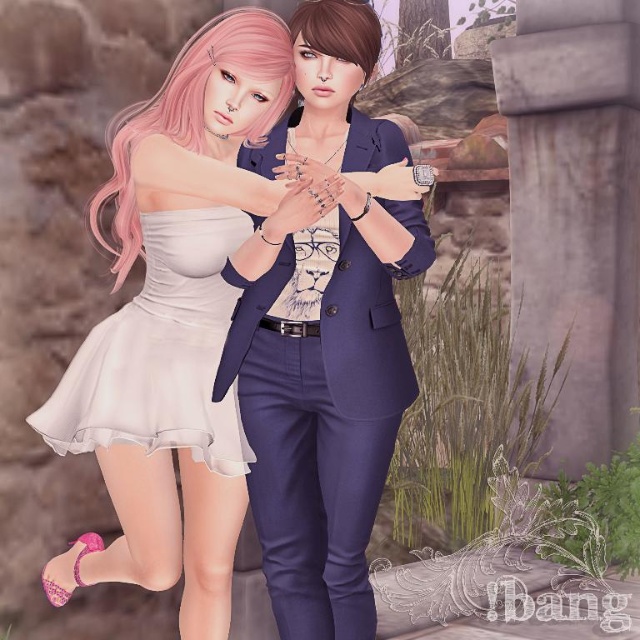
Looking at this image, does navy blue suit at center have a smaller size compared to white satin dress at center?

No.

Measure the distance between navy blue suit at center and camera.

A distance of 1.78 meters exists between navy blue suit at center and camera.

Locate an element on the screen. navy blue suit at center is located at coordinates (323, 422).

Can you confirm if matte white dress at center is positioned above white satin dress at center?

Correct, matte white dress at center is located above white satin dress at center.

Describe the element at coordinates (173, 324) in the screenshot. I see `matte white dress at center` at that location.

Is point (216, 272) positioned before point (67, 444)?

Yes, point (216, 272) is in front of point (67, 444).

The height and width of the screenshot is (640, 640). In order to click on matte white dress at center in this screenshot , I will do `click(173, 324)`.

Is matte white dress at center smaller than navy blue suit at center?

No.

Which is above, matte white dress at center or navy blue suit at center?

Positioned higher is matte white dress at center.

Where is `matte white dress at center`? The width and height of the screenshot is (640, 640). matte white dress at center is located at coordinates click(x=173, y=324).